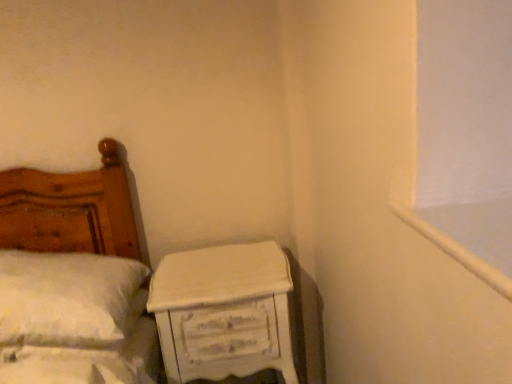
Question: Based on their sizes in the image, would you say white fluffy pillow at left is bigger or smaller than white painted wood at upper right?

Choices:
 (A) small
 (B) big

Answer: (B)

Question: In terms of width, does white fluffy pillow at left look wider or thinner when compared to white painted wood at upper right?

Choices:
 (A) thin
 (B) wide

Answer: (B)

Question: Considering the real-world distances, which object is farthest from the white fluffy pillow at left?

Choices:
 (A) white painted wood at upper right
 (B) white distressed wood nightstand at lower right

Answer: (A)

Question: Estimate the real-world distances between objects in this image. Which object is closer to the white distressed wood nightstand at lower right?

Choices:
 (A) white painted wood at upper right
 (B) white fluffy pillow at left

Answer: (B)